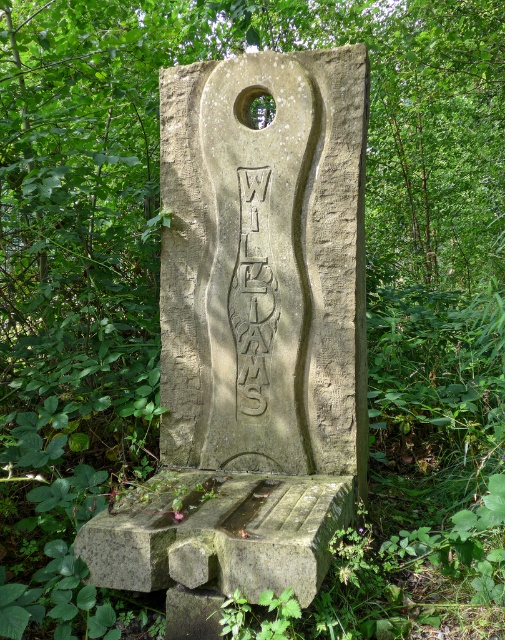
You are an archaeologist examining the stone structure in the forest. You notice the stone carving at center and the carved stone text at center. Which object is taller?

The stone carving at center is much taller than the carved stone text at center.

You are standing in front of the stone monument in the forest. You notice two points marked on the stone. The first point is at coordinates point [219,168] and the second is at point [246,275]. Which point is closer to your eyes?

Point [219,168] is closer to the camera than point [246,275], so the first point is closer to your eyes.